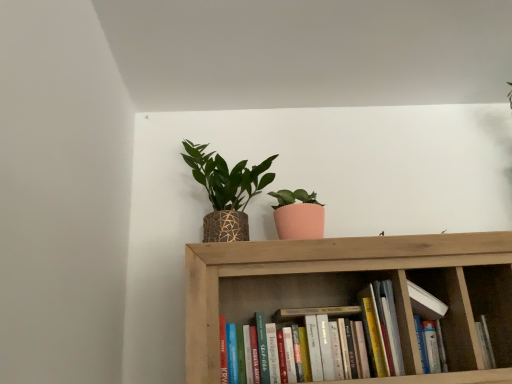
Question: Considering their positions, is white matte book at center, which ranks as the 2th book in left-to-right order, located in front of or behind textured woven pot at upper center?

Choices:
 (A) front
 (B) behind

Answer: (A)

Question: From a real-world perspective, is white matte book at center, which ranks as the 2th book in left-to-right order, above or below textured woven pot at upper center?

Choices:
 (A) above
 (B) below

Answer: (B)

Question: Estimate the real-world distances between objects in this image. Which object is closer to the textured woven pot at upper center?

Choices:
 (A) hardcover books at center, placed as the 2th book when sorted from right to left
 (B) white matte book at center, positioned as the first book in right-to-left order
 (C) wooden bookshelf at center

Answer: (C)

Question: Estimate the real-world distances between objects in this image. Which object is farther from the hardcover books at center, placed as the 2th book when sorted from right to left?

Choices:
 (A) white matte book at center, positioned as the first book in right-to-left order
 (B) wooden bookshelf at center
 (C) textured woven pot at upper center

Answer: (C)